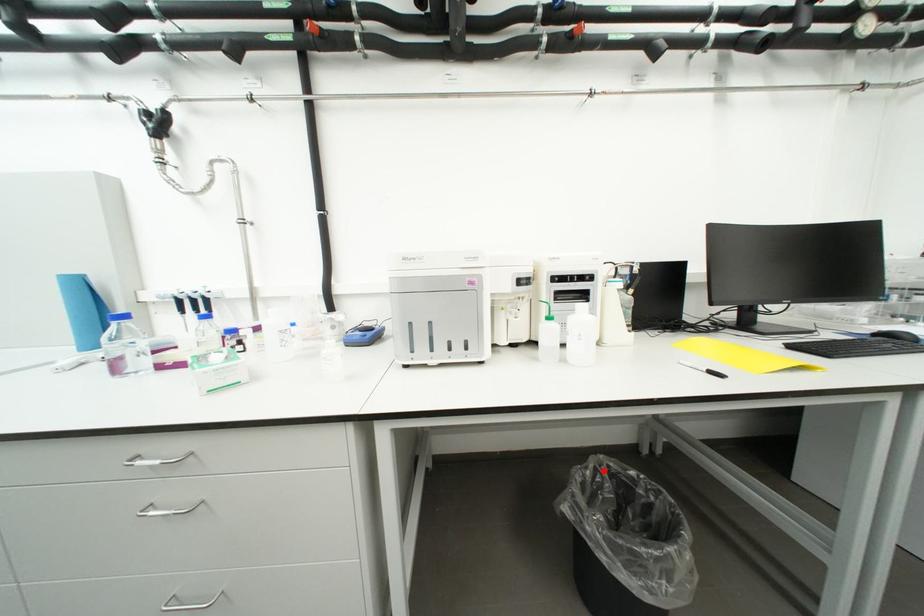
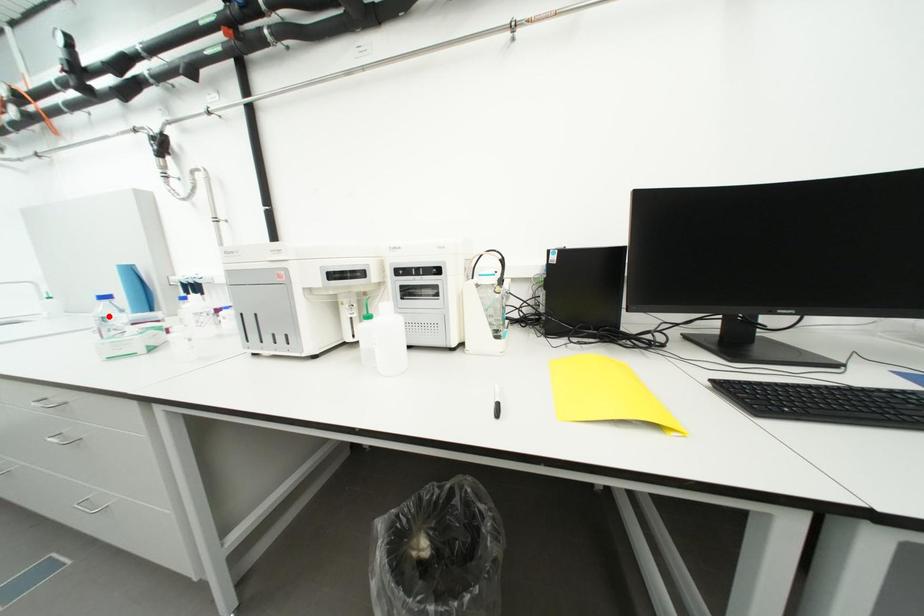
I am providing you with two images of the same scene from different viewpoints. A red point is marked on the first image and another point is marked on the second image. Does the point marked in image1 correspond to the same location as the one in image2?

No